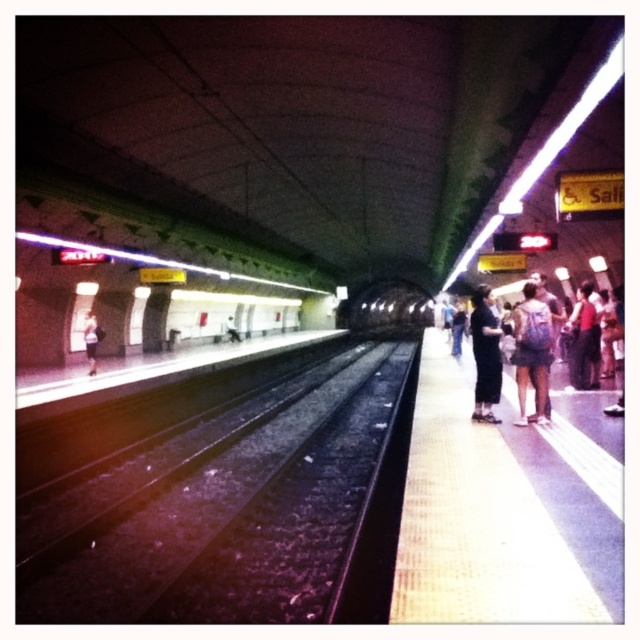
Does black asphalt train track at center appear on the left side of black fabric pants at center?

Yes, black asphalt train track at center is to the left of black fabric pants at center.

Can you confirm if black asphalt train track at center is taller than black fabric pants at center?

No.

Is point (204, 541) positioned behind point (492, 397)?

No, it is not.

This screenshot has width=640, height=640. I want to click on black asphalt train track at center, so click(x=218, y=506).

Can you confirm if yellow textured platform at right is shorter than black fabric pants at center?

Yes, yellow textured platform at right is shorter than black fabric pants at center.

Measure the distance between yellow textured platform at right and black fabric pants at center.

2.94 meters

The image size is (640, 640). What do you see at coordinates (496, 516) in the screenshot? I see `yellow textured platform at right` at bounding box center [496, 516].

You are a GUI agent. You are given a task and a screenshot of the screen. Output one action in this format:
    pyautogui.click(x=<x>, y=<y>)
    Task: Click on the yellow textured platform at right
    The image size is (640, 640).
    Given the screenshot: What is the action you would take?
    pyautogui.click(x=496, y=516)

Who is positioned more to the right, yellow textured platform at right or blue backpack at right?

Positioned to the right is yellow textured platform at right.

Which is below, yellow textured platform at right or blue backpack at right?

yellow textured platform at right is lower down.

Between point (566, 532) and point (525, 333), which one is positioned in front?

Point (566, 532)

Locate an element on the screen. This screenshot has width=640, height=640. yellow textured platform at right is located at coordinates (496, 516).